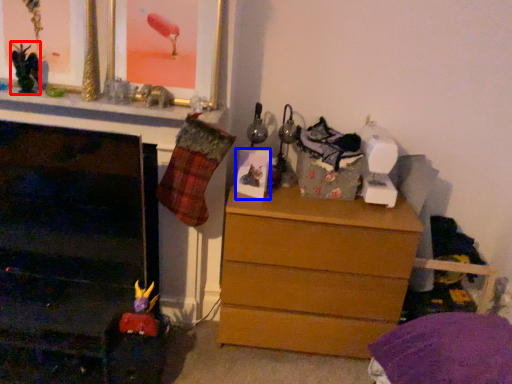
Question: Which object appears farthest to the camera in this image, toy (highlighted by a red box) or picture frame (highlighted by a blue box)?

Choices:
 (A) toy
 (B) picture frame

Answer: (B)